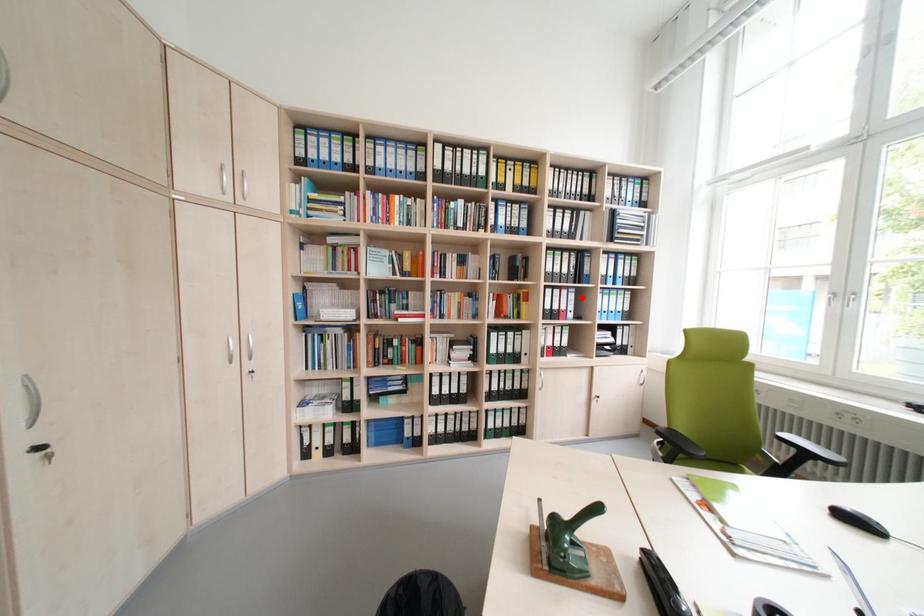
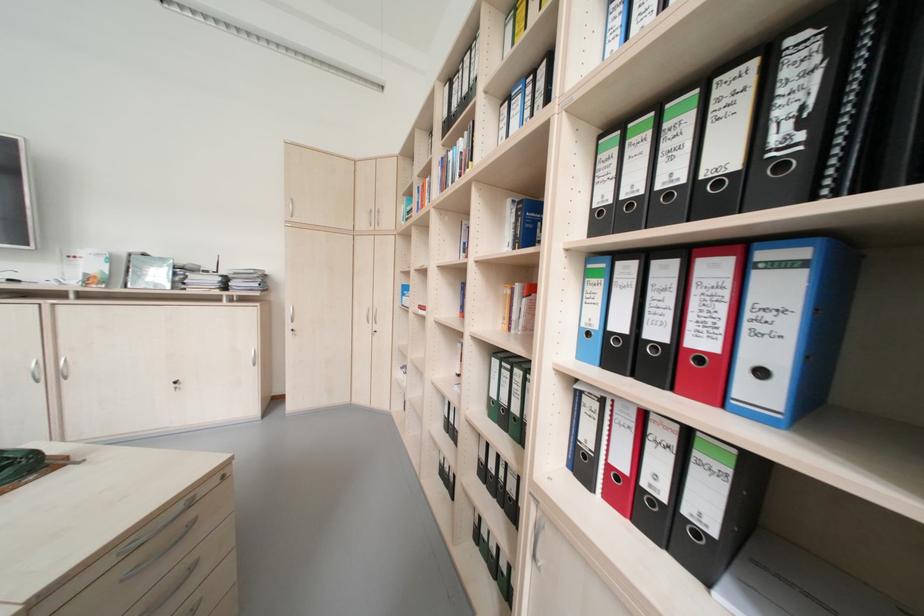
Question: I am providing you with two images of the same scene from different viewpoints. A red point is marked on the first image. At the location where the point appears in image 1, is it still visible in image 2?

Choices:
 (A) Yes
 (B) No

Answer: (A)